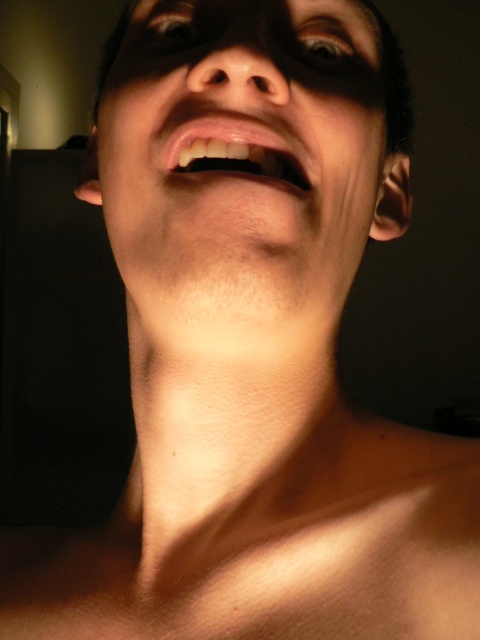
Question: Which of these objects is positioned closest to the brown matte eye at upper center?

Choices:
 (A) smooth skin mouth at center
 (B) smooth skin face at center

Answer: (B)

Question: From the image, what is the correct spatial relationship of smooth skin face at center in relation to smooth skin mouth at center?

Choices:
 (A) above
 (B) below

Answer: (A)

Question: Does brown matte eye at upper center have a greater width compared to shiny blue eye at upper center?

Choices:
 (A) no
 (B) yes

Answer: (B)

Question: Which of the following is the closest to the observer?

Choices:
 (A) (228, 134)
 (B) (355, 51)
 (C) (199, 3)

Answer: (A)

Question: Which point is closer to the camera?

Choices:
 (A) shiny blue eye at upper center
 (B) smooth skin mouth at center
 (C) brown matte eye at upper center
 (D) smooth skin face at center

Answer: (D)

Question: Can you confirm if smooth skin mouth at center is bigger than brown matte eye at upper center?

Choices:
 (A) no
 (B) yes

Answer: (B)